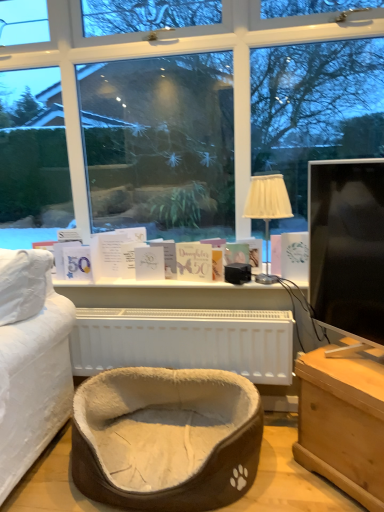
Question: Is beige plush pet bed at center oriented away from black glossy monitor at right?

Choices:
 (A) no
 (B) yes

Answer: (A)

Question: Is beige plush pet bed at center far away from black glossy monitor at right?

Choices:
 (A) yes
 (B) no

Answer: (B)

Question: Could you tell me if beige plush pet bed at center is facing black glossy monitor at right?

Choices:
 (A) yes
 (B) no

Answer: (B)

Question: Can you confirm if beige plush pet bed at center is positioned to the left of black glossy monitor at right?

Choices:
 (A) no
 (B) yes

Answer: (B)

Question: From the image's perspective, does beige plush pet bed at center appear higher than black glossy monitor at right?

Choices:
 (A) yes
 (B) no

Answer: (B)

Question: Visually, is beige fabric lampshade at center positioned to the left or to the right of light brown wooden chest at lower right?

Choices:
 (A) left
 (B) right

Answer: (A)

Question: Is point (251, 187) closer or farther from the camera than point (367, 494)?

Choices:
 (A) farther
 (B) closer

Answer: (A)

Question: Based on their sizes in the image, would you say beige fabric lampshade at center is bigger or smaller than light brown wooden chest at lower right?

Choices:
 (A) small
 (B) big

Answer: (A)

Question: From the image's perspective, relative to light brown wooden chest at lower right, is beige fabric lampshade at center above or below?

Choices:
 (A) below
 (B) above

Answer: (B)

Question: In terms of height, does white paper card at center, positioned as the third book in right-to-left order, look taller or shorter compared to black glossy monitor at right?

Choices:
 (A) tall
 (B) short

Answer: (B)

Question: From the image's perspective, is white paper card at center, the first book viewed from the left, located above or below black glossy monitor at right?

Choices:
 (A) below
 (B) above

Answer: (A)

Question: Based on their sizes in the image, would you say white paper card at center, the first book viewed from the left, is bigger or smaller than black glossy monitor at right?

Choices:
 (A) big
 (B) small

Answer: (B)

Question: From a real-world perspective, is white paper card at center, the first book viewed from the left, physically located above or below black glossy monitor at right?

Choices:
 (A) below
 (B) above

Answer: (A)

Question: From a real-world perspective, is white paper card at center, positioned as the third book in right-to-left order, physically located above or below matte gold card at center, placed as the second book when sorted from left to right?

Choices:
 (A) above
 (B) below

Answer: (B)

Question: Is white paper card at center, positioned as the third book in right-to-left order, taller or shorter than matte gold card at center, placed as the second book when sorted from left to right?

Choices:
 (A) short
 (B) tall

Answer: (A)